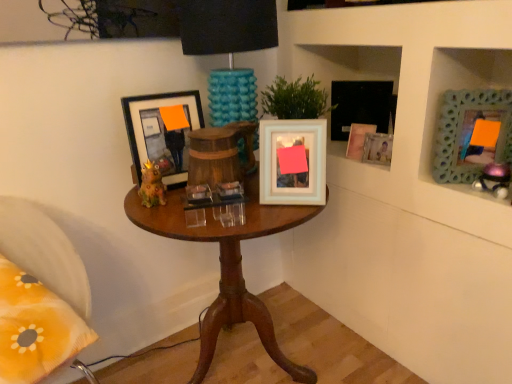
Question: Considering the relative sizes of wooden table at center and matte black picture frame at left, the first picture frame positioned from the left, in the image provided, is wooden table at center bigger than matte black picture frame at left, the first picture frame positioned from the left,?

Choices:
 (A) yes
 (B) no

Answer: (A)

Question: Considering the relative sizes of wooden table at center and matte black picture frame at left, the first picture frame positioned from the left, in the image provided, is wooden table at center smaller than matte black picture frame at left, the first picture frame positioned from the left,?

Choices:
 (A) yes
 (B) no

Answer: (B)

Question: From the image's perspective, is wooden table at center under matte black picture frame at left, the 6th picture frame viewed from the right?

Choices:
 (A) no
 (B) yes

Answer: (B)

Question: Is wooden table at center not within matte black picture frame at left, the 6th picture frame viewed from the right?

Choices:
 (A) no
 (B) yes

Answer: (B)

Question: Can you confirm if wooden table at center is positioned to the left of matte black picture frame at left, the first picture frame positioned from the left?

Choices:
 (A) no
 (B) yes

Answer: (A)

Question: Is wooden table at center wider than matte black picture frame at left, the first picture frame positioned from the left?

Choices:
 (A) no
 (B) yes

Answer: (B)

Question: Is the position of matte white picture frame at upper right, the 4th picture frame when ordered from right to left, less distant than that of yellow fabric pillow at lower left?

Choices:
 (A) no
 (B) yes

Answer: (A)

Question: From a real-world perspective, is matte white picture frame at upper right, the 4th picture frame when ordered from right to left, on top of yellow fabric pillow at lower left?

Choices:
 (A) yes
 (B) no

Answer: (A)

Question: From the image's perspective, does matte white picture frame at upper right, the 3th picture frame viewed from the left, appear lower than yellow fabric pillow at lower left?

Choices:
 (A) yes
 (B) no

Answer: (B)

Question: Is matte white picture frame at upper right, the 3th picture frame viewed from the left, not close to yellow fabric pillow at lower left?

Choices:
 (A) yes
 (B) no

Answer: (A)

Question: Can you confirm if matte white picture frame at upper right, the 4th picture frame when ordered from right to left, is taller than yellow fabric pillow at lower left?

Choices:
 (A) no
 (B) yes

Answer: (A)

Question: Is yellow fabric pillow at lower left at the back of matte white picture frame at upper right, the 4th picture frame when ordered from right to left?

Choices:
 (A) no
 (B) yes

Answer: (A)

Question: Does yellow fabric pillow at lower left have a smaller size compared to metallic purple toy at upper right, placed as the first toy when sorted from right to left?

Choices:
 (A) yes
 (B) no

Answer: (B)